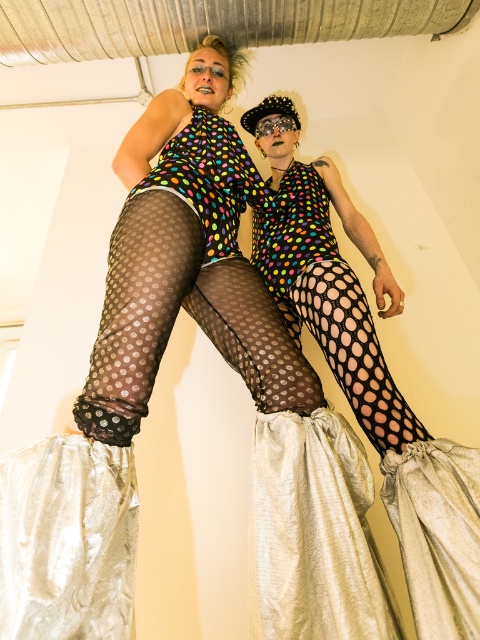
Based on the scene description, what is located at the coordinates point (369, 372)?

The point (369, 372) corresponds to polka dot fabric at center.

You are an artist creating a costume design inspired by the two performers in the image. You need to decide which fabric to prioritize based on their sizes. Which fabric should you use more of, the polka dot fabric at center or the fishnet tights at center?

The polka dot fabric at center is bigger than the fishnet tights at center, so you should use more of the polka dot fabric at center in your costume design.